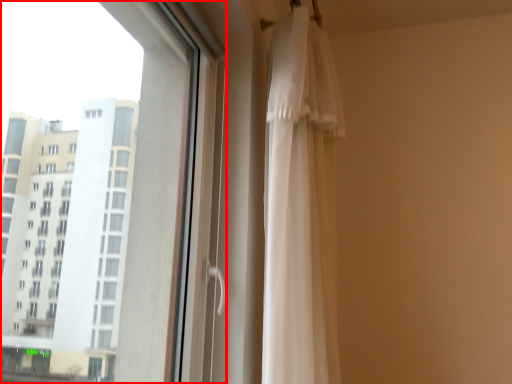
Question: Considering the relative positions of window (annotated by the red box) and curtain in the image provided, where is window (annotated by the red box) located with respect to the staircase?

Choices:
 (A) right
 (B) left

Answer: (B)